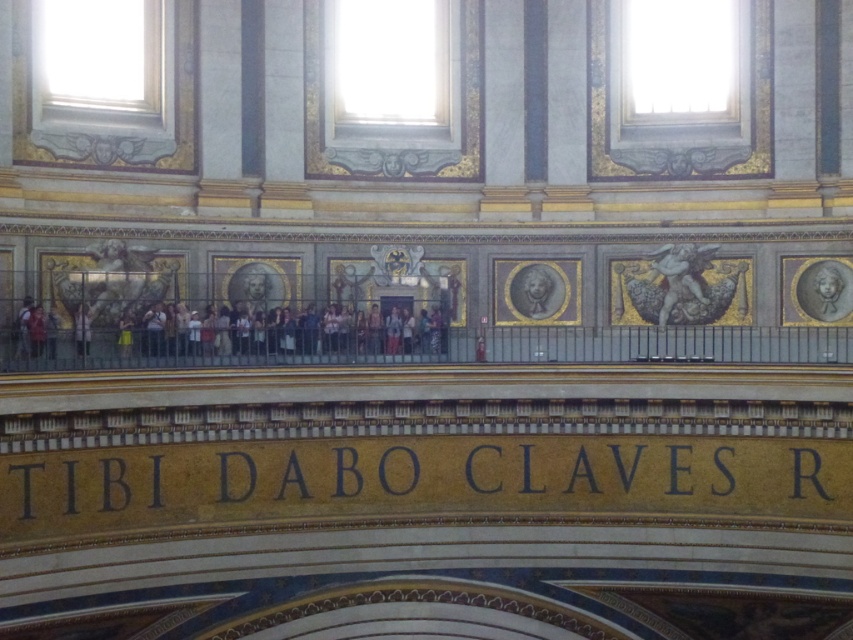
From the picture: You are an architect designing a new lighting system for the grand building. The smooth gray stone portrait at upper right and the gray stone bust at center are both important features. If your lighting equipment has a maximum reach of 12 meters, will it be sufficient to illuminate both features from a central point?

The distance between the smooth gray stone portrait at upper right and the gray stone bust at center is 12.68 meters. Since the lighting equipment has a maximum reach of 12 meters, it will not be sufficient to illuminate both features from a central point as the distance exceeds the equipment capability.

From the picture: You are an interior designer assessing the grand building. You need to determine which object is taller between the polished bronze cherub at upper right and the gray stone bust at center. Which one is taller?

The polished bronze cherub at upper right is taller than the gray stone bust at center.

You are an art conservator examining the upper section of the building. You notice the smooth gray stone portrait at upper right and the gray stone bust at center. Which object is positioned higher up in the image?

The gray stone bust at center is positioned higher up in the image than the smooth gray stone portrait at upper right.